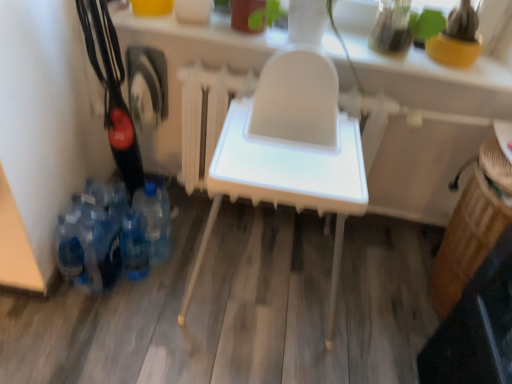
Where is `free spot to the right of blue translucent bottle at lower left, the second bottle in the left-to-right sequence`? The image size is (512, 384). free spot to the right of blue translucent bottle at lower left, the second bottle in the left-to-right sequence is located at coordinates (176, 287).